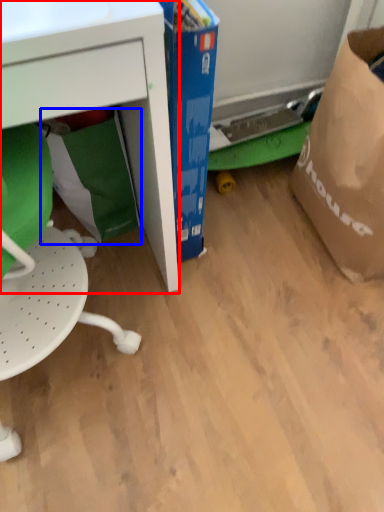
Question: Which object appears closest to the camera in this image, desk (highlighted by a red box) or grocery bag (highlighted by a blue box)?

Choices:
 (A) desk
 (B) grocery bag

Answer: (A)